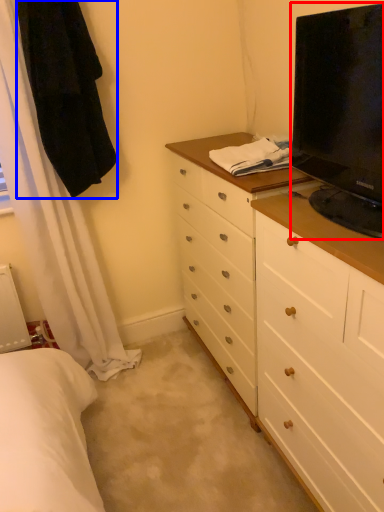
Question: Which object is closer to the camera taking this photo, television (highlighted by a red box) or robe (highlighted by a blue box)?

Choices:
 (A) television
 (B) robe

Answer: (A)